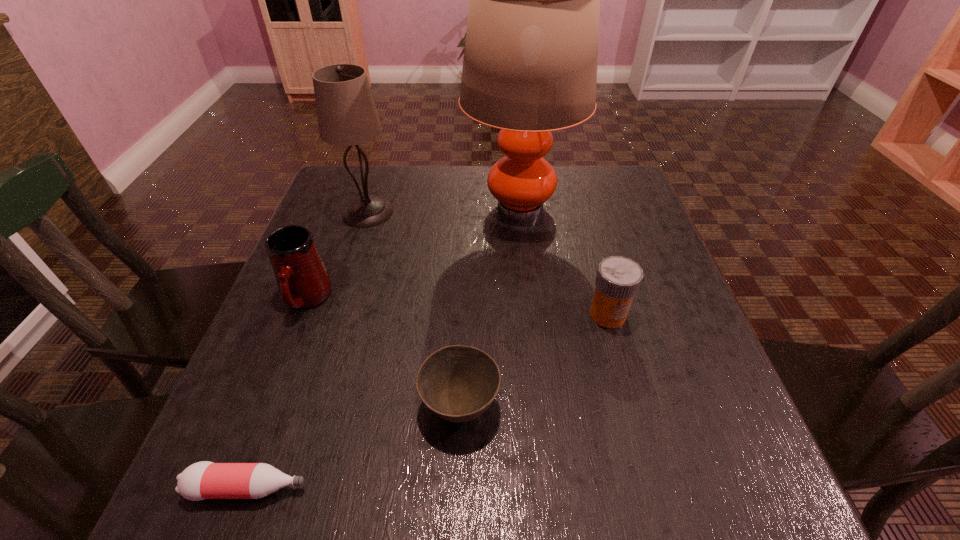
Locate an element on the screen. free space located 0.130m on the side of the fourth shortest object with the handle is located at coordinates (274, 382).

You are a GUI agent. You are given a task and a screenshot of the screen. Output one action in this format:
    pyautogui.click(x=<x>, y=<y>)
    Task: Click on the free spot located on the label side of the fourth tallest object
    This screenshot has height=540, width=960.
    Given the screenshot: What is the action you would take?
    pyautogui.click(x=633, y=404)

At what (x,y) coordinates should I click in order to perform the action: click on vacant area situated 0.250m on the back of the fifth tallest object. Please return your answer as a coordinate pair (x, y). Looking at the image, I should click on click(465, 275).

Identify the location of free space located with the cap open on the bottle. The width and height of the screenshot is (960, 540). (425, 488).

Where is `lamp that is at the far edge`? lamp that is at the far edge is located at coordinates tap(530, 61).

At what (x,y) coordinates should I click in order to perform the action: click on lampshade situated at the far edge. Please return your answer as a coordinate pair (x, y). Looking at the image, I should click on (346, 112).

Find the location of a particular element. The height and width of the screenshot is (540, 960). object situated at the near edge is located at coordinates (203, 480).

The height and width of the screenshot is (540, 960). What are the coordinates of `lampshade at the left edge` in the screenshot? It's located at (346, 112).

Find the location of a particular element. mug positioned at the left edge is located at coordinates (303, 281).

This screenshot has width=960, height=540. Identify the location of bottle that is at the left edge. (203, 480).